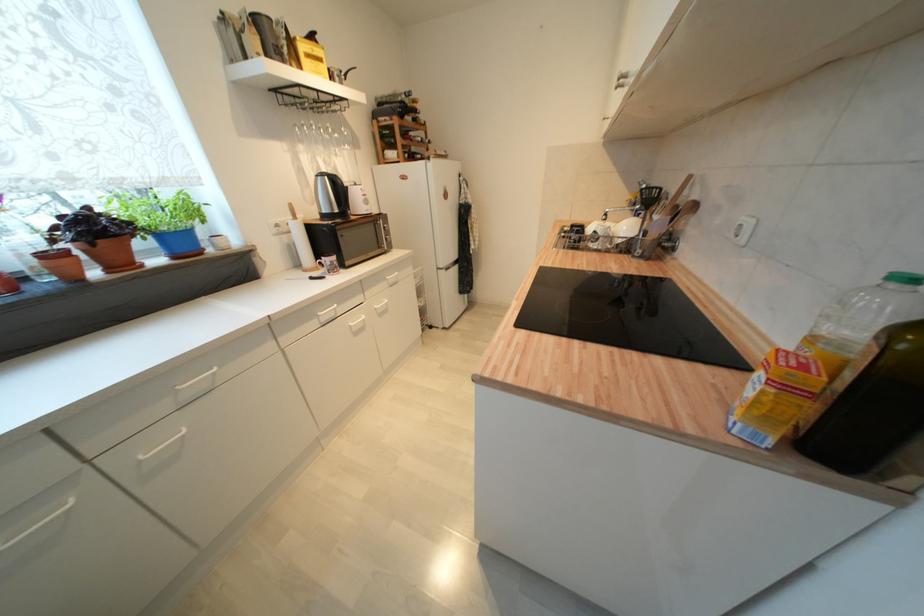
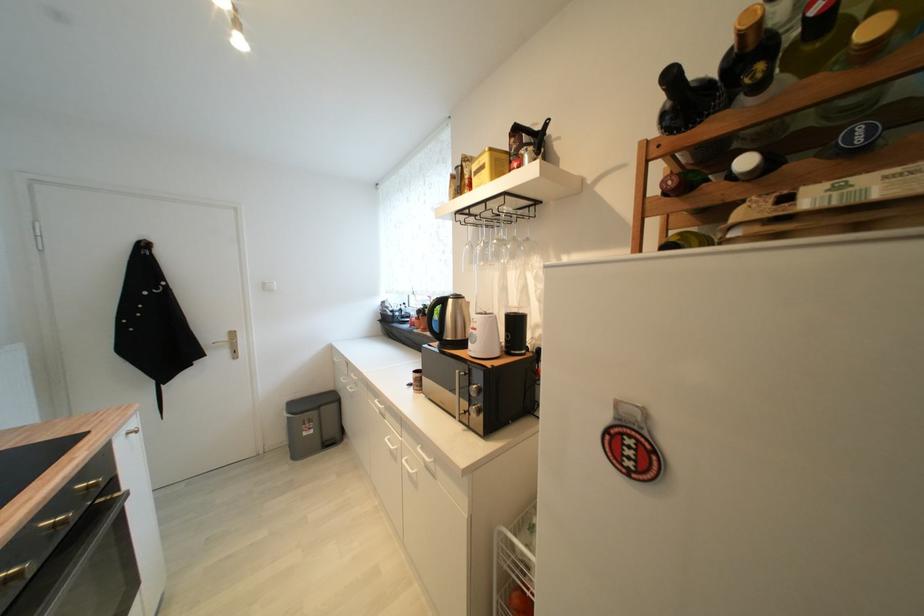
Locate, in the second image, the point that corresponds to pixel 315 54 in the first image.

(483, 169)